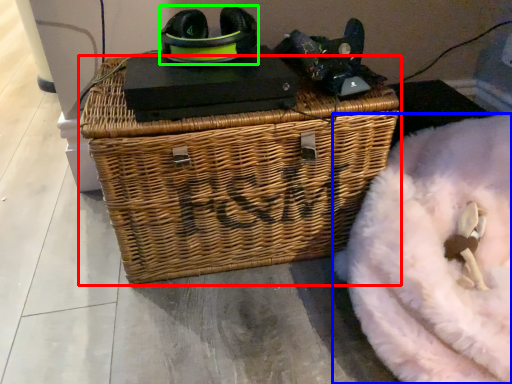
Question: Which object is the closest to the picnic basket (highlighted by a red box)? Choose among these: bean bag chair (highlighted by a blue box) or shoe (highlighted by a green box).

Choices:
 (A) bean bag chair
 (B) shoe

Answer: (A)